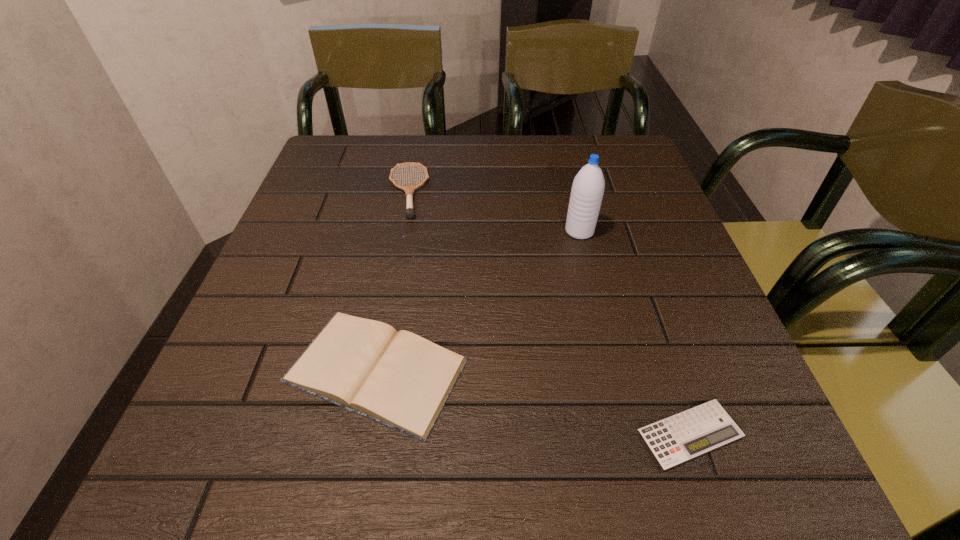
This screenshot has height=540, width=960. I want to click on the second farthest object, so click(588, 187).

This screenshot has width=960, height=540. Find the location of `water bottle`. water bottle is located at coordinates (588, 187).

Identify the location of the farthest object. This screenshot has height=540, width=960. (409, 212).

The height and width of the screenshot is (540, 960). Find the location of `Bible`. Bible is located at coordinates (399, 379).

Locate an element on the screen. the shortest object is located at coordinates (677, 439).

The height and width of the screenshot is (540, 960). I want to click on free spot located 0.290m on the back of the second farthest object, so click(561, 154).

Locate an element on the screen. The width and height of the screenshot is (960, 540). vacant space located on the right of the tennis racket is located at coordinates (542, 192).

The width and height of the screenshot is (960, 540). What are the coordinates of `vacant space located 0.290m on the back of the Bible` in the screenshot? It's located at (405, 215).

This screenshot has height=540, width=960. Find the location of `vacant position located 0.150m on the left of the shortest object`. vacant position located 0.150m on the left of the shortest object is located at coordinates (536, 434).

Locate an element on the screen. This screenshot has height=540, width=960. object located in the far edge section of the desktop is located at coordinates (409, 212).